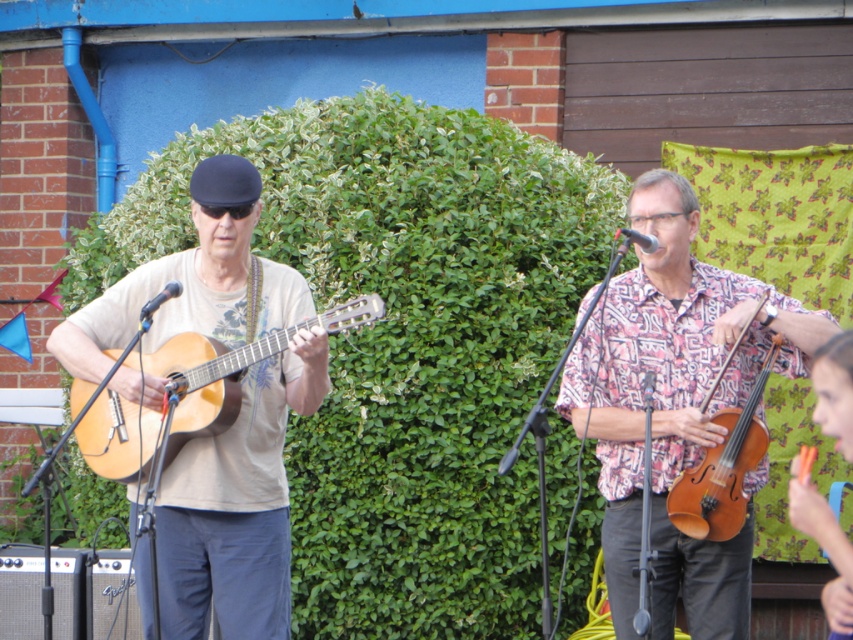
You are a photographer trying to capture both the matte brown guitar at left and the light brown acoustic guitar at left in a single frame. Given that your camera has a minimum focus distance of 5.5 inches, will you be able to focus on both guitars simultaneously?

The matte brown guitar at left is 5.67 inches away from the light brown acoustic guitar at left. Since the distance between them is just over the camera minimum focus distance of 5.5 inches, you can focus on both guitars simultaneously.